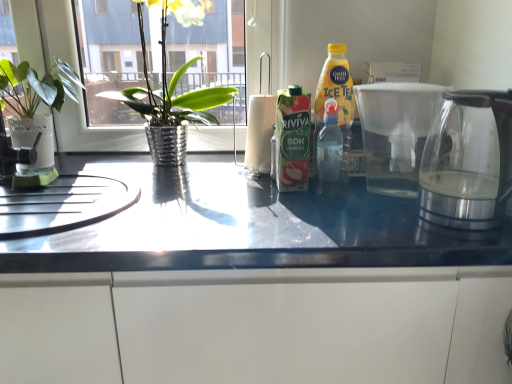
Question: Are glossy white cabinet at lower center and transparent glass kettle at right, which is counted as the 2th coffeepot, starting from the back, located far from each other?

Choices:
 (A) no
 (B) yes

Answer: (A)

Question: Can you confirm if glossy white cabinet at lower center is taller than transparent glass kettle at right, the first coffeepot positioned from the front?

Choices:
 (A) no
 (B) yes

Answer: (B)

Question: Is glossy white cabinet at lower center looking in the opposite direction of transparent glass kettle at right, which is counted as the 2th coffeepot, starting from the back?

Choices:
 (A) yes
 (B) no

Answer: (B)

Question: From a real-world perspective, does glossy white cabinet at lower center stand above transparent glass kettle at right, which is counted as the 2th coffeepot, starting from the back?

Choices:
 (A) yes
 (B) no

Answer: (B)

Question: Is glossy white cabinet at lower center aimed at transparent glass kettle at right, which is counted as the 2th coffeepot, starting from the back?

Choices:
 (A) no
 (B) yes

Answer: (A)

Question: Choose the correct answer: Is transparent glass coffeepot at right, placed as the 1th coffeepot when sorted from back to front, inside green cardboard carton at center or outside it?

Choices:
 (A) outside
 (B) inside

Answer: (A)

Question: Considering their positions, is transparent glass coffeepot at right, placed as the 1th coffeepot when sorted from back to front, located in front of or behind green cardboard carton at center?

Choices:
 (A) behind
 (B) front

Answer: (B)

Question: Considering the positions of transparent glass coffeepot at right, placed as the 1th coffeepot when sorted from back to front, and green cardboard carton at center in the image, is transparent glass coffeepot at right, placed as the 1th coffeepot when sorted from back to front, bigger or smaller than green cardboard carton at center?

Choices:
 (A) small
 (B) big

Answer: (B)

Question: From a real-world perspective, is transparent glass coffeepot at right, placed as the 1th coffeepot when sorted from back to front, above or below green cardboard carton at center?

Choices:
 (A) below
 (B) above

Answer: (A)

Question: In terms of size, does metallic silver pot at left, which appears as the 1th houseplant when viewed from the right, appear bigger or smaller than green cardboard carton at center?

Choices:
 (A) big
 (B) small

Answer: (A)

Question: Is point (185, 145) positioned closer to the camera than point (292, 134)?

Choices:
 (A) closer
 (B) farther

Answer: (B)

Question: Is metallic silver pot at left, which ranks as the second houseplant in left-to-right order, taller or shorter than green cardboard carton at center?

Choices:
 (A) tall
 (B) short

Answer: (A)

Question: From a real-world perspective, is metallic silver pot at left, which ranks as the second houseplant in left-to-right order, physically located above or below green cardboard carton at center?

Choices:
 (A) below
 (B) above

Answer: (B)

Question: Would you say glossy white cabinet at lower center is inside or outside green cardboard carton at center?

Choices:
 (A) inside
 (B) outside

Answer: (B)

Question: Is point (231, 304) closer or farther from the camera than point (298, 152)?

Choices:
 (A) closer
 (B) farther

Answer: (A)